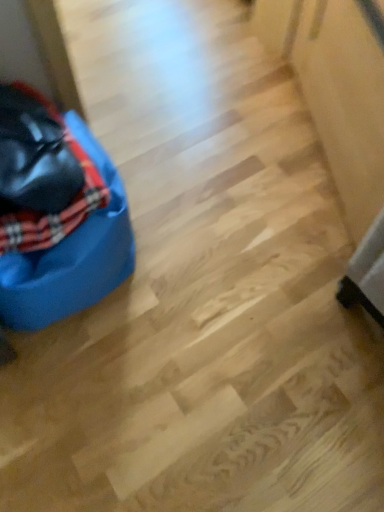
Identify the location of empty space that is to the right of blue fabric bean bag at left. This screenshot has width=384, height=512. (203, 258).